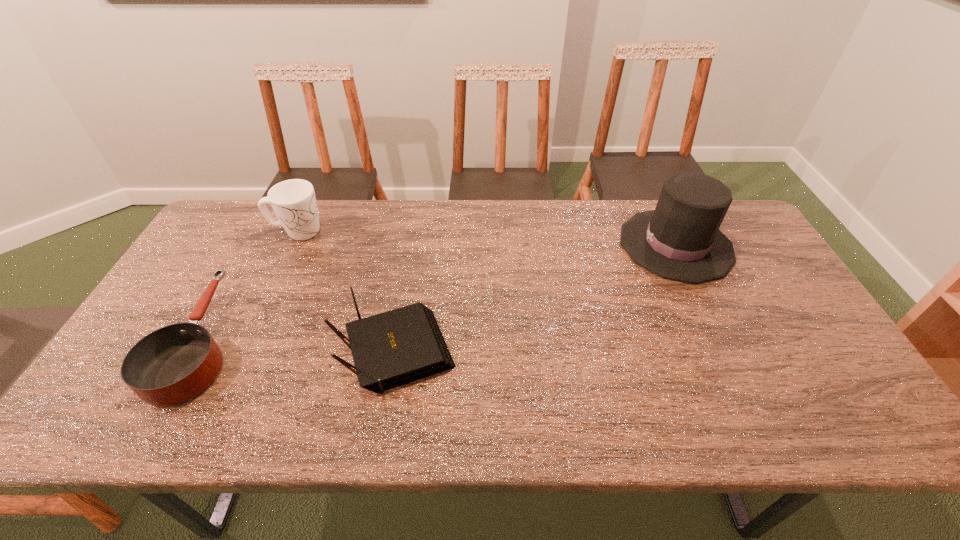
In order to click on the tallest object in this screenshot , I will do `click(680, 240)`.

Where is `the rightmost object`? The image size is (960, 540). the rightmost object is located at coordinates (680, 240).

This screenshot has width=960, height=540. What are the coordinates of `mug` in the screenshot? It's located at (294, 202).

You are a GUI agent. You are given a task and a screenshot of the screen. Output one action in this format:
    pyautogui.click(x=<x>, y=<y>)
    Task: Click on the router
    The height and width of the screenshot is (540, 960).
    Given the screenshot: What is the action you would take?
    pyautogui.click(x=397, y=347)

You are a GUI agent. You are given a task and a screenshot of the screen. Output one action in this format:
    pyautogui.click(x=<x>, y=<y>)
    Task: Click on the second object from right to left
    This screenshot has height=540, width=960.
    Given the screenshot: What is the action you would take?
    pyautogui.click(x=397, y=347)

Identify the location of the shortest object. (171, 365).

Image resolution: width=960 pixels, height=540 pixels. What are the coordinates of `vacant region located 0.310m on the front of the dress hat with the decoration` in the screenshot? It's located at (521, 245).

At what (x,y) coordinates should I click in order to perform the action: click on vacant point located 0.160m on the front of the dress hat with the decoration. Please return your answer as a coordinate pair (x, y). The width and height of the screenshot is (960, 540). Looking at the image, I should click on (569, 245).

In order to click on free space located 0.310m on the front of the dress hat with the decoration in this screenshot , I will do `click(521, 245)`.

The height and width of the screenshot is (540, 960). I want to click on free space located 0.300m on the side of the mug with the handle, so click(418, 232).